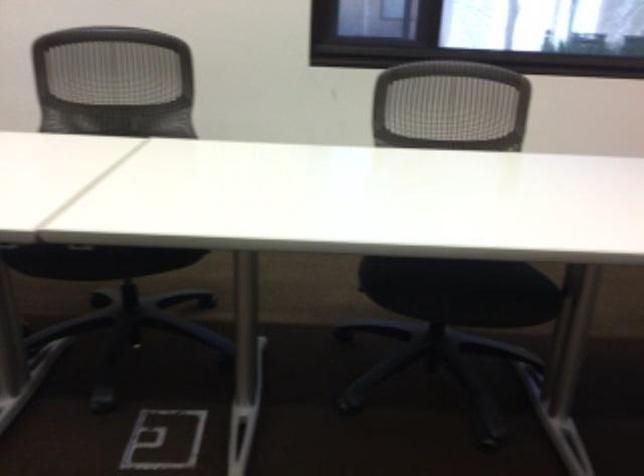
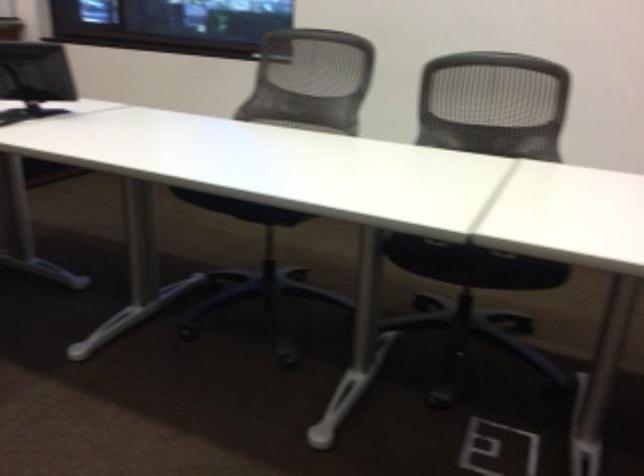
Locate, in the second image, the point that corresponds to (109,251) in the first image.

(471, 264)